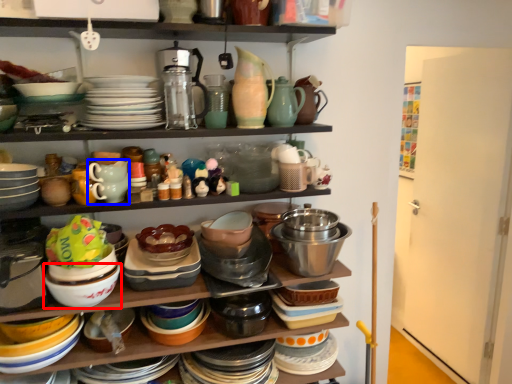
Question: Which object is closer to the camera taking this photo, bowl (highlighted by a red box) or tableware (highlighted by a blue box)?

Choices:
 (A) bowl
 (B) tableware

Answer: (A)